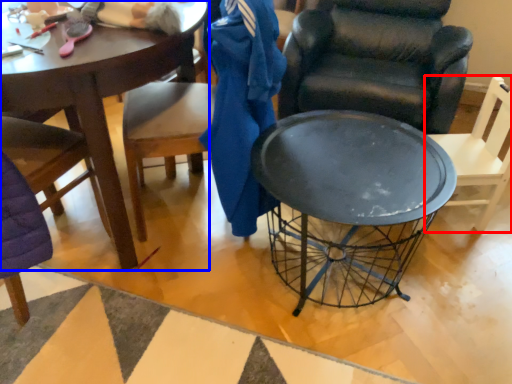
Question: Which object appears closest to the camera in this image, chair (highlighted by a red box) or coffee table (highlighted by a blue box)?

Choices:
 (A) chair
 (B) coffee table

Answer: (B)